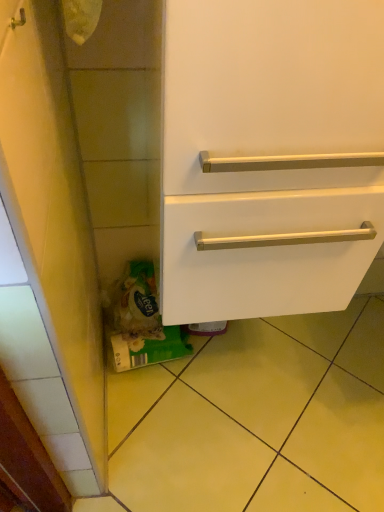
Question: Is yellow tile at lower left outside white matte drawer at center?

Choices:
 (A) no
 (B) yes

Answer: (B)

Question: Is yellow tile at lower left not near white matte drawer at center?

Choices:
 (A) yes
 (B) no

Answer: (B)

Question: Can you confirm if yellow tile at lower left is bigger than white matte drawer at center?

Choices:
 (A) yes
 (B) no

Answer: (B)

Question: From the image's perspective, would you say yellow tile at lower left is shown under white matte drawer at center?

Choices:
 (A) no
 (B) yes

Answer: (B)

Question: From a real-world perspective, is yellow tile at lower left located higher than white matte drawer at center?

Choices:
 (A) yes
 (B) no

Answer: (B)

Question: From the image's perspective, would you say yellow tile at lower left is positioned over white matte drawer at center?

Choices:
 (A) no
 (B) yes

Answer: (A)

Question: Is the surface of white matte drawer at center in direct contact with yellow tile at lower left?

Choices:
 (A) no
 (B) yes

Answer: (A)

Question: Is white matte drawer at center located outside yellow tile at lower left?

Choices:
 (A) no
 (B) yes

Answer: (B)

Question: Is white matte drawer at center taller than yellow tile at lower left?

Choices:
 (A) yes
 (B) no

Answer: (A)

Question: Does white matte drawer at center turn towards yellow tile at lower left?

Choices:
 (A) no
 (B) yes

Answer: (A)

Question: Would you say white matte drawer at center contains yellow tile at lower left?

Choices:
 (A) no
 (B) yes

Answer: (A)

Question: Can you confirm if white matte drawer at center is wider than yellow tile at lower left?

Choices:
 (A) yes
 (B) no

Answer: (B)

Question: Is yellow tile at lower left in front of or behind white matte drawer at center in the image?

Choices:
 (A) behind
 (B) front

Answer: (A)